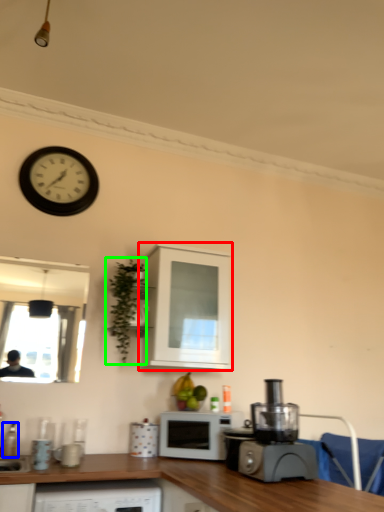
Question: Which object is positioned farthest from cabinetry (highlighted by a red box)? Select from bottle (highlighted by a blue box) and plant (highlighted by a green box).

Choices:
 (A) bottle
 (B) plant

Answer: (A)